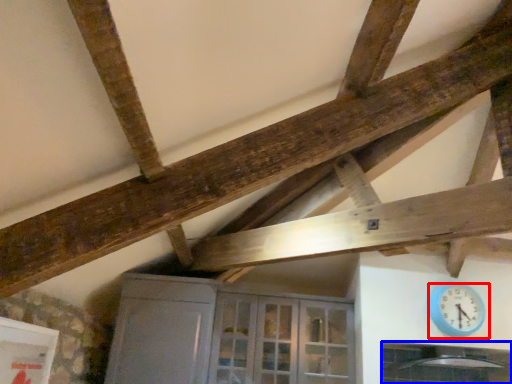
Question: Which of the following is the closest to the observer, wall clock (highlighted by a red box) or window (highlighted by a blue box)?

Choices:
 (A) wall clock
 (B) window

Answer: (B)